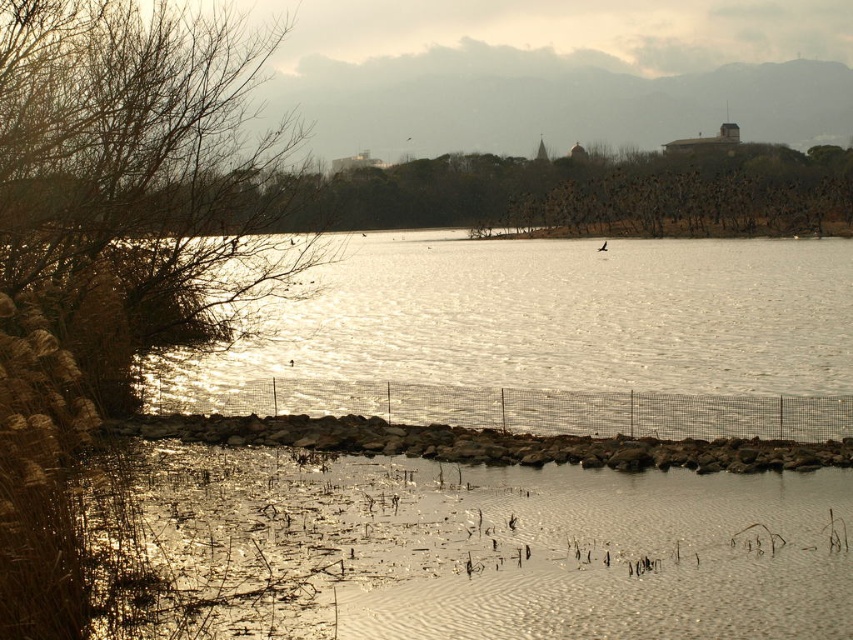
Between brown leafless branches at left and rusty stone wall at lower center, which one appears on the right side from the viewer's perspective?

rusty stone wall at lower center

Is point (88, 19) farther from camera compared to point (647, 456)?

That is False.

This screenshot has height=640, width=853. I want to click on brown leafless branches at left, so click(137, 168).

Which is in front, point (364, 308) or point (277, 445)?

Point (277, 445)

Is point (738, 403) positioned in front of point (821, 448)?

That is False.

Who is more forward, (708, 296) or (351, 428)?

Point (351, 428)

Identify the location of glistening water at center. The image size is (853, 640). (554, 339).

Can you confirm if glistening water at center is positioned below brown leafless branches at left?

Indeed, glistening water at center is positioned under brown leafless branches at left.

Describe the element at coordinates (554, 339) in the screenshot. I see `glistening water at center` at that location.

This screenshot has width=853, height=640. Find the location of `glistening water at center`. glistening water at center is located at coordinates (554, 339).